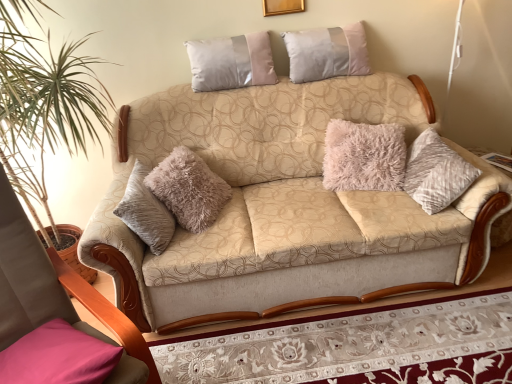
Question: Would you say gold wooden picture frame at upper center is to the left or to the right of pink fabric pillow at lower left, which is the 3th pillow from back to front, in the picture?

Choices:
 (A) left
 (B) right

Answer: (B)

Question: Is gold wooden picture frame at upper center taller or shorter than pink fabric pillow at lower left, which is the 3th pillow from back to front?

Choices:
 (A) short
 (B) tall

Answer: (B)

Question: Based on their relative distances, which object is farther from the silky silver pillow at upper center, the third pillow in the bottom-to-top sequence?

Choices:
 (A) beige fabric couch at center
 (B) pink fabric pillow at lower left, which is the 3th pillow from back to front
 (C) satin-like beige pillow at upper center, the second pillow positioned from the back
 (D) wooden armchair at left
 (E) gold wooden picture frame at upper center

Answer: (B)

Question: Which is farther from the pink fabric pillow at lower left, which is the 3th pillow from back to front?

Choices:
 (A) wooden armchair at left
 (B) silky silver pillow at upper center, the third pillow in the bottom-to-top sequence
 (C) gold wooden picture frame at upper center
 (D) satin-like beige pillow at upper center, the second pillow viewed from the left
 (E) beige fabric couch at center

Answer: (C)